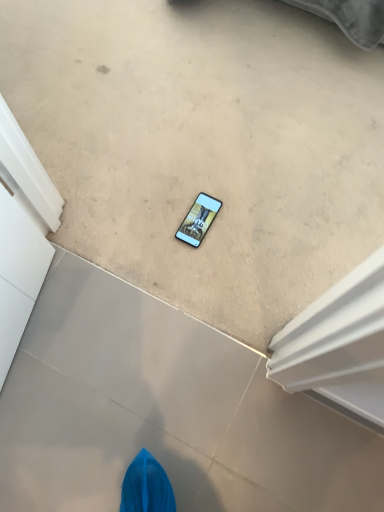
Question: Considering the positions of matte black phone at center and beige carpet at center, acting as the 1th concrete starting from the top, in the image, is matte black phone at center bigger or smaller than beige carpet at center, acting as the 1th concrete starting from the top,?

Choices:
 (A) small
 (B) big

Answer: (A)

Question: Is matte black phone at center taller or shorter than beige carpet at center, acting as the 1th concrete starting from the top?

Choices:
 (A) short
 (B) tall

Answer: (A)

Question: Which of these objects is positioned farthest from the matte black phone at center?

Choices:
 (A) beige carpet at center, acting as the 1th concrete starting from the top
 (B) matte gray concrete at center, the first concrete ordered from the bottom

Answer: (B)

Question: Which object is the farthest from the matte black phone at center?

Choices:
 (A) beige carpet at center, acting as the 1th concrete starting from the top
 (B) matte gray concrete at center, the first concrete ordered from the bottom

Answer: (B)